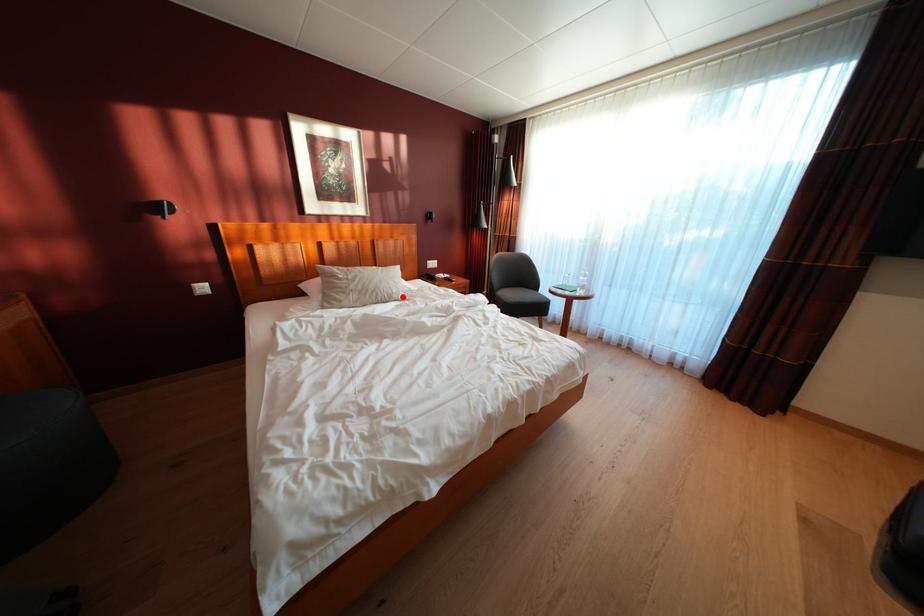
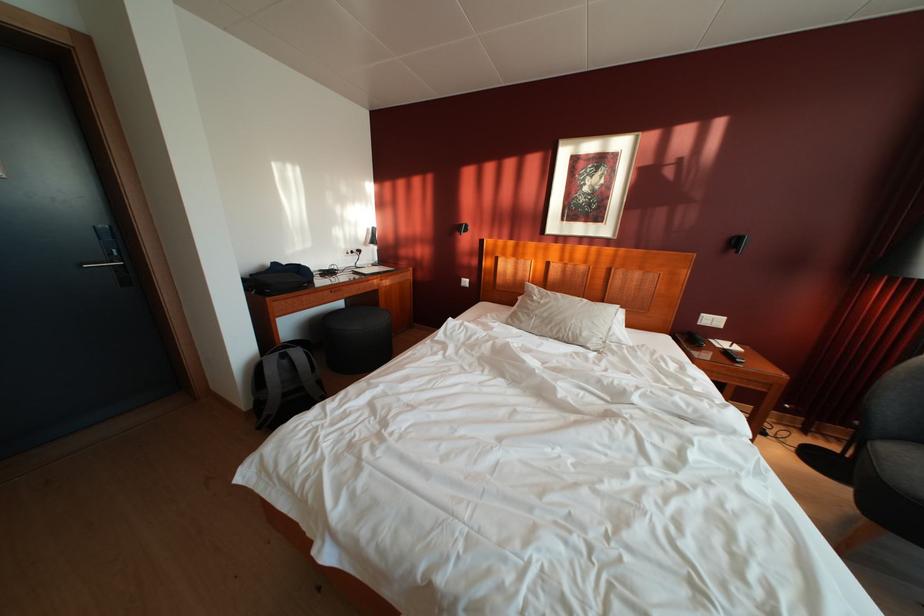
Find the pixel in the second image that matches the highlighted location in the first image.

(593, 339)